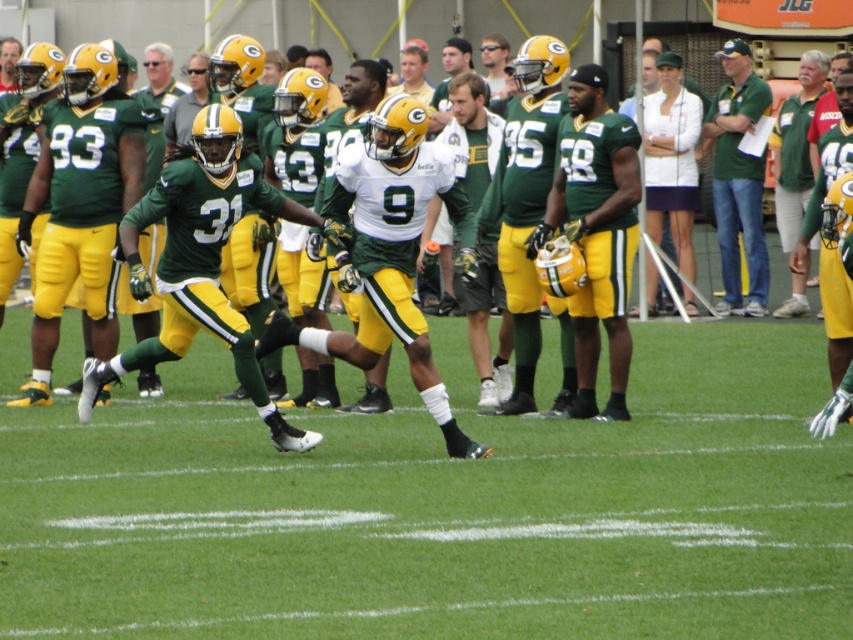
Is matte green uniform at center smaller than green matte jersey at upper right?

Yes.

Is point (535, 230) positioned in front of point (817, 90)?

Yes, it is in front of point (817, 90).

Identify the location of matte green uniform at center. This screenshot has width=853, height=640. (595, 232).

Does matte green jersey at center have a lesser width compared to green matte shirt at upper right?

Incorrect, matte green jersey at center's width is not less than green matte shirt at upper right's.

Is matte green jersey at center taller than green matte shirt at upper right?

Incorrect, matte green jersey at center's height is not larger of green matte shirt at upper right's.

Who is more distant from viewer, (526, 157) or (758, 292)?

The point (758, 292) is behind.

Where is `matte green jersey at center`? The height and width of the screenshot is (640, 853). matte green jersey at center is located at coordinates (x=500, y=221).

Does green matte shirt at upper right have a larger size compared to green matte jersey at upper right?

Incorrect, green matte shirt at upper right is not larger than green matte jersey at upper right.

Which is behind, point (722, 268) or point (802, 81)?

The point (722, 268) is more distant.

This screenshot has height=640, width=853. What are the coordinates of `green matte shirt at upper right` in the screenshot? It's located at (738, 179).